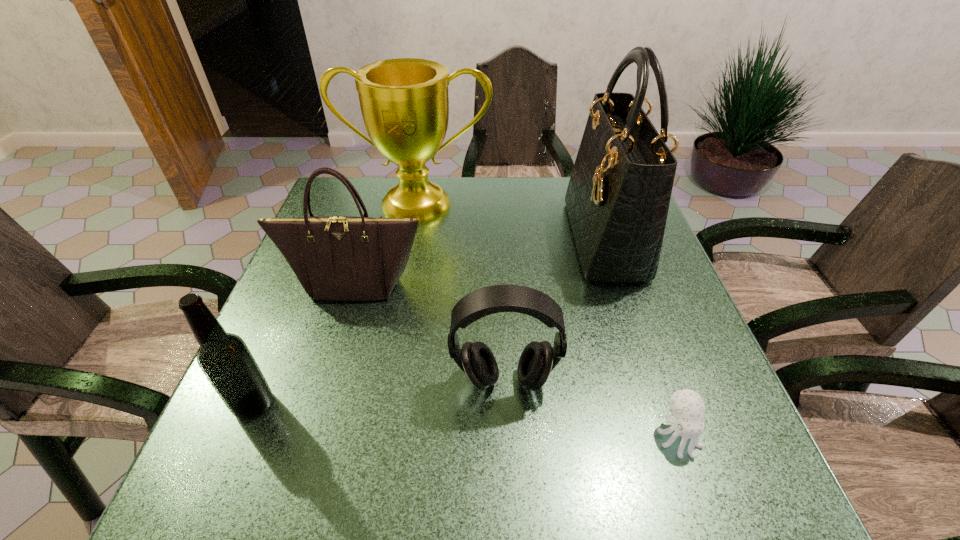
You are a GUI agent. You are given a task and a screenshot of the screen. Output one action in this format:
    pyautogui.click(x=<x>, y=<y>)
    Task: Click on the taller handbag
    This screenshot has width=960, height=540.
    Given the screenshot: What is the action you would take?
    pyautogui.click(x=618, y=196)

You are a GUI agent. You are given a task and a screenshot of the screen. Output one action in this format:
    pyautogui.click(x=<x>, y=<y>)
    Task: Click on the right handbag
    
    Given the screenshot: What is the action you would take?
    pyautogui.click(x=618, y=196)

You are a GUI agent. You are given a task and a screenshot of the screen. Output one action in this format:
    pyautogui.click(x=<x>, y=<y>)
    Task: Click on the award
    The image size is (960, 540).
    Given the screenshot: What is the action you would take?
    pyautogui.click(x=404, y=102)

The width and height of the screenshot is (960, 540). I want to click on the shorter handbag, so [x=336, y=258].

At what (x,y) coordinates should I click in order to perform the action: click on beer bottle. Please return your answer as a coordinate pair (x, y). Looking at the image, I should click on (224, 358).

The height and width of the screenshot is (540, 960). Identify the location of earphone. (538, 359).

Where is `the shortest object`? The width and height of the screenshot is (960, 540). the shortest object is located at coordinates (687, 406).

Where is `vacant space located 0.290m at the front of the tallest object with visible charms`? vacant space located 0.290m at the front of the tallest object with visible charms is located at coordinates (463, 239).

Identify the location of free spot located at the front of the tallest object with visible charms. (531, 239).

Where is `free space located 0.050m at the front of the tallest object with visible charms`? The image size is (960, 540). free space located 0.050m at the front of the tallest object with visible charms is located at coordinates (554, 239).